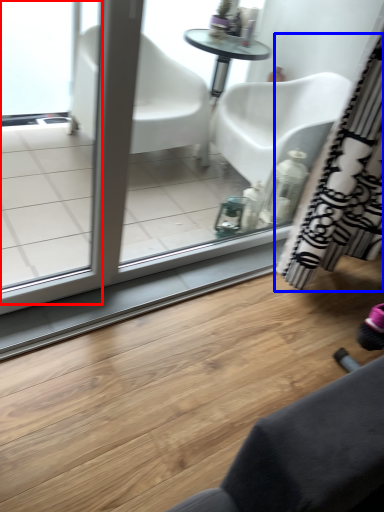
Question: Which of the following is the closest to the observer, screen door (highlighted by a red box) or curtain (highlighted by a blue box)?

Choices:
 (A) screen door
 (B) curtain

Answer: (A)